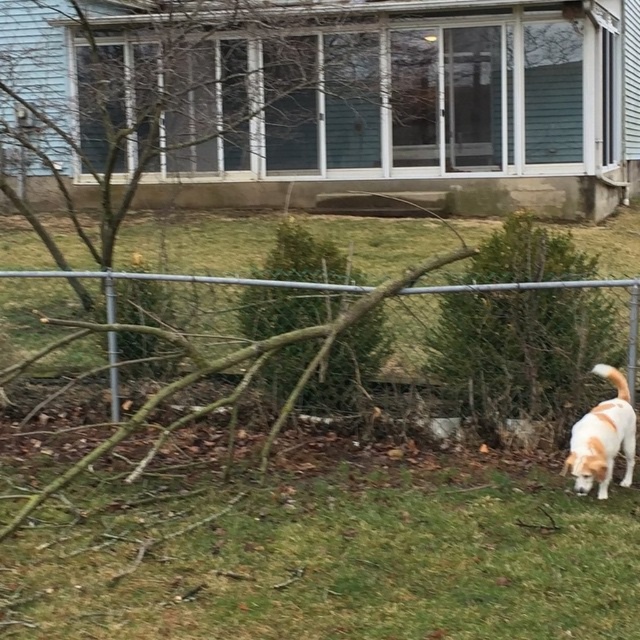
Can you confirm if green grass at lower right is positioned below metallic silver fence at center?

Yes.

Is green grass at lower right smaller than metallic silver fence at center?

Correct, green grass at lower right occupies less space than metallic silver fence at center.

Is point (81, 545) closer to viewer compared to point (433, 291)?

Yes, point (81, 545) is in front of point (433, 291).

The image size is (640, 640). Identify the location of green grass at lower right. coord(346,561).

Is point (506, 557) positioned after point (595, 432)?

No, (506, 557) is in front of (595, 432).

Identify the location of green grass at lower right. The height and width of the screenshot is (640, 640). (346, 561).

Does green grass at lower right appear on the right side of brown textured tree at center?

In fact, green grass at lower right is to the left of brown textured tree at center.

Is green grass at lower right taller than brown textured tree at center?

Incorrect, green grass at lower right's height is not larger of brown textured tree at center's.

Which is in front, point (314, 636) or point (593, 275)?

Point (314, 636) is in front.

Where is `green grass at lower right`? The height and width of the screenshot is (640, 640). green grass at lower right is located at coordinates (346, 561).